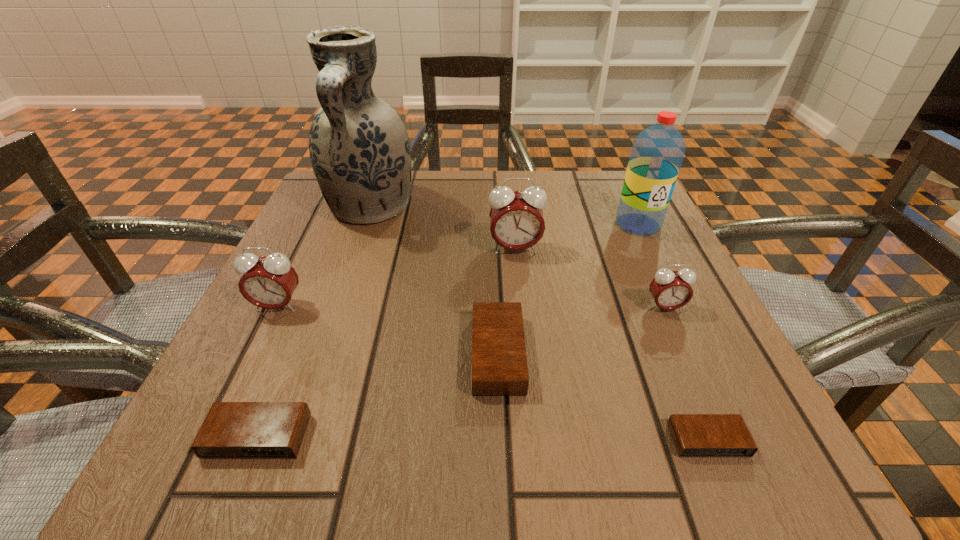
Identify which alarm clock is the fifth closest to the fifth tallest object. Please provide its 2D coordinates. Your answer should be formatted as a tuple, i.e. [(x, y)], where the tuple contains the x and y coordinates of a point satisfying the conditions above.

[(268, 282)]

This screenshot has height=540, width=960. What are the coordinates of `pink alarm clock that is the second closest to the leftmost pink alarm clock` in the screenshot? It's located at (671, 290).

Locate which pink alarm clock ranks in proximity to the smallest black alarm clock. Please provide its 2D coordinates. Your answer should be formatted as a tuple, i.e. [(x, y)], where the tuple contains the x and y coordinates of a point satisfying the conditions above.

[(671, 290)]

Find the location of a particular element. Image resolution: width=960 pixels, height=540 pixels. the closest black alarm clock to the sixth farthest object is located at coordinates (694, 435).

Choose which black alarm clock is the nearest neighbor to the second black alarm clock from left to right. Please provide its 2D coordinates. Your answer should be formatted as a tuple, i.e. [(x, y)], where the tuple contains the x and y coordinates of a point satisfying the conditions above.

[(694, 435)]

You are a GUI agent. You are given a task and a screenshot of the screen. Output one action in this format:
    pyautogui.click(x=<x>, y=<y>)
    Task: Click on the free space that satisfies the following two spatial constraints: 1. on the clock face of the sixth shortest object; 2. on the front face of the farthest black alarm clock
    The height and width of the screenshot is (540, 960).
    Given the screenshot: What is the action you would take?
    pos(525,354)

Where is `free location that satisfies the following two spatial constraints: 1. on the clock face of the rightmost pink alarm clock; 2. on the front face of the biggest black alarm clock`? This screenshot has height=540, width=960. free location that satisfies the following two spatial constraints: 1. on the clock face of the rightmost pink alarm clock; 2. on the front face of the biggest black alarm clock is located at coordinates (685, 354).